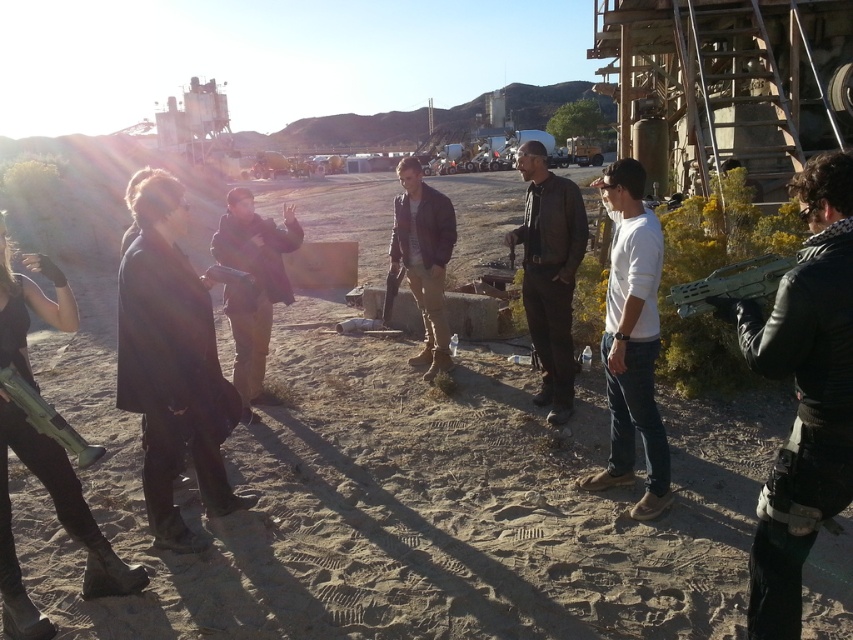
Does leather jacket at right have a greater width compared to dark brown leather jacket at center?

No, leather jacket at right is not wider than dark brown leather jacket at center.

This screenshot has width=853, height=640. I want to click on leather jacket at right, so click(804, 394).

Where is `leather jacket at right`? The image size is (853, 640). leather jacket at right is located at coordinates (804, 394).

Can you confirm if brown sandy dirt field at center is smaller than white cotton shirt at center?

Incorrect, brown sandy dirt field at center is not smaller in size than white cotton shirt at center.

Can you confirm if brown sandy dirt field at center is taller than white cotton shirt at center?

Indeed, brown sandy dirt field at center has a greater height compared to white cotton shirt at center.

Between point (107, 598) and point (640, 234), which one is positioned behind?

Positioned behind is point (640, 234).

Find the location of a particular element. The width and height of the screenshot is (853, 640). brown sandy dirt field at center is located at coordinates (402, 500).

Is white cotton shirt at center thinner than leather jacket at center?

Incorrect, white cotton shirt at center's width is not less than leather jacket at center's.

The image size is (853, 640). Identify the location of white cotton shirt at center. (631, 340).